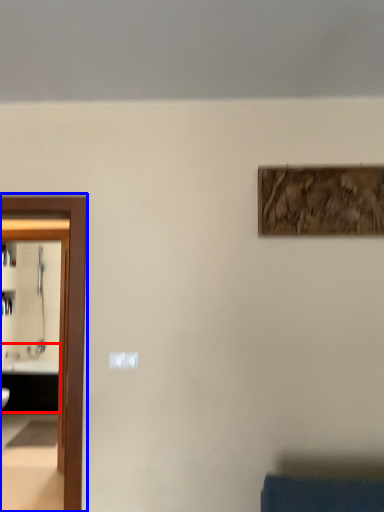
Question: Which point is closer to the camera, sink (highlighted by a red box) or elevator (highlighted by a blue box)?

Choices:
 (A) sink
 (B) elevator

Answer: (B)